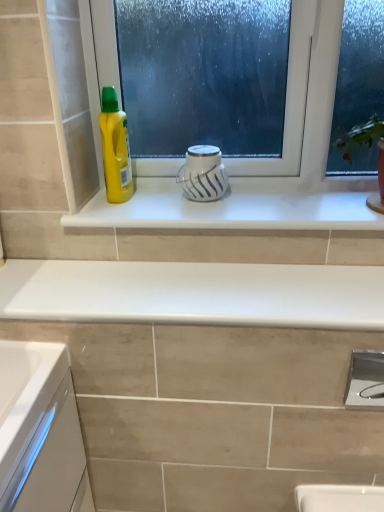
I want to click on free spot to the left of white glossy mug at center, so click(x=143, y=203).